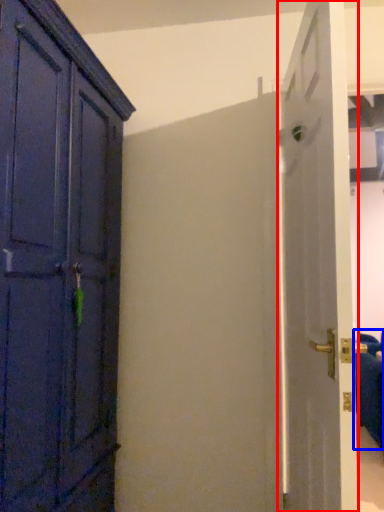
Question: Among these objects, which one is nearest to the camera, door (highlighted by a red box) or furniture (highlighted by a blue box)?

Choices:
 (A) door
 (B) furniture

Answer: (A)